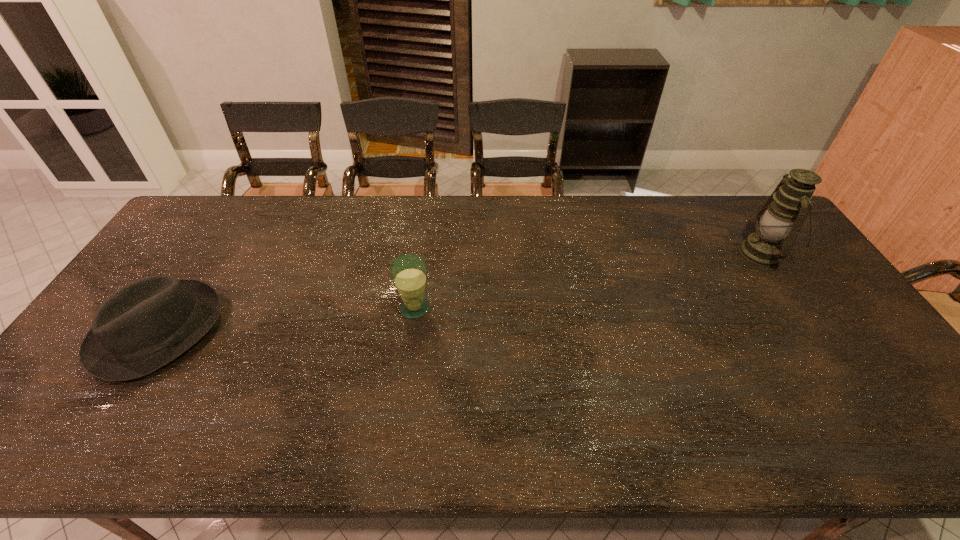
This screenshot has width=960, height=540. In order to click on oil lamp in this screenshot , I will do `click(783, 214)`.

The height and width of the screenshot is (540, 960). In order to click on the tallest object in this screenshot , I will do `click(783, 214)`.

Locate an element on the screen. the second object from left to right is located at coordinates (409, 273).

The image size is (960, 540). What are the coordinates of `the second shortest object` in the screenshot? It's located at (409, 273).

You are a GUI agent. You are given a task and a screenshot of the screen. Output one action in this format:
    pyautogui.click(x=<x>, y=<y>)
    Task: Click on the fedora
    The height and width of the screenshot is (540, 960).
    Given the screenshot: What is the action you would take?
    pyautogui.click(x=141, y=327)

I want to click on the shortest object, so click(141, 327).

I want to click on blank area located on the back of the rightmost object, so click(732, 207).

This screenshot has height=540, width=960. Find the location of `vacant position located 0.370m on the left of the second shortest object`. vacant position located 0.370m on the left of the second shortest object is located at coordinates (268, 308).

The height and width of the screenshot is (540, 960). I want to click on vacant region located 0.390m on the right of the leftmost object, so click(361, 330).

Where is `object that is at the far edge`? object that is at the far edge is located at coordinates (783, 214).